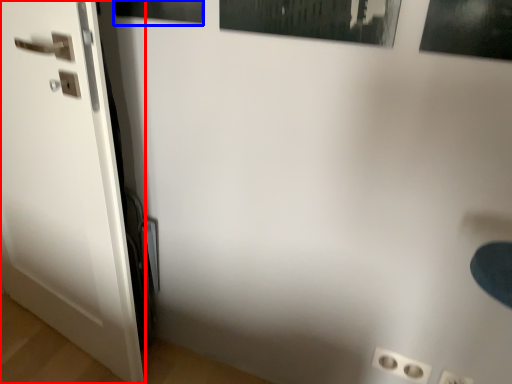
Question: Among these objects, which one is farthest to the camera, door (highlighted by a red box) or picture frame (highlighted by a blue box)?

Choices:
 (A) door
 (B) picture frame

Answer: (B)